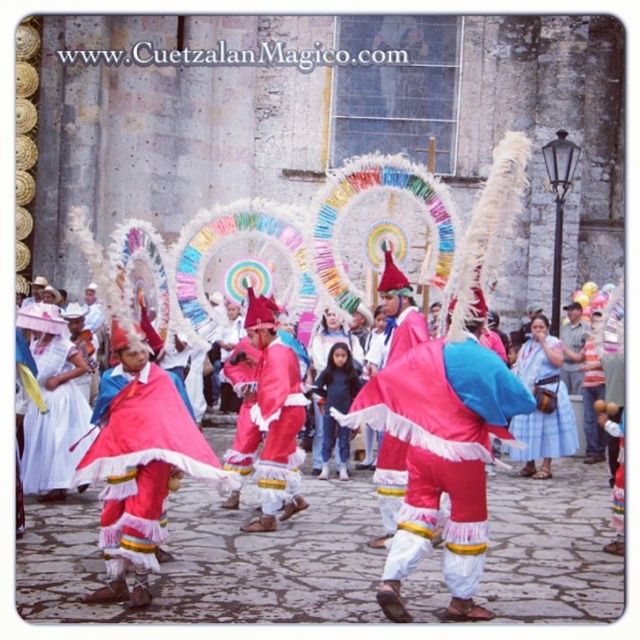
You are a photographer at the festival and want to capture the matte pink fabric at center in your shot. Based on its position, where should you aim your camera?

The matte pink fabric at center is located at point (x=442, y=449), so you should aim your camera towards that coordinate to capture it.